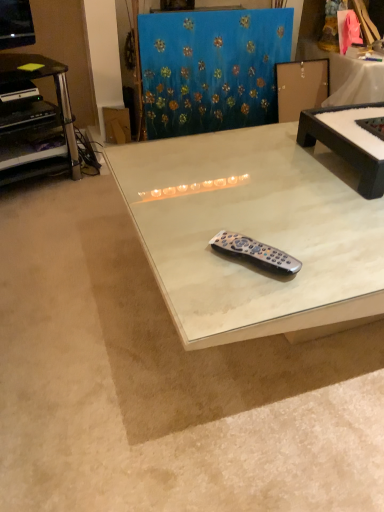
What are the coordinates of `blank space situated above white marble table at center, the 1th table positioned from the left (from a real-world perspective)` in the screenshot? It's located at (274, 183).